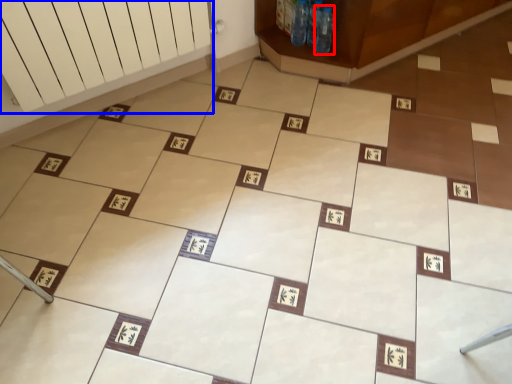
Question: Among these objects, which one is farthest to the camera, bottle (highlighted by a red box) or radiator (highlighted by a blue box)?

Choices:
 (A) bottle
 (B) radiator

Answer: (A)